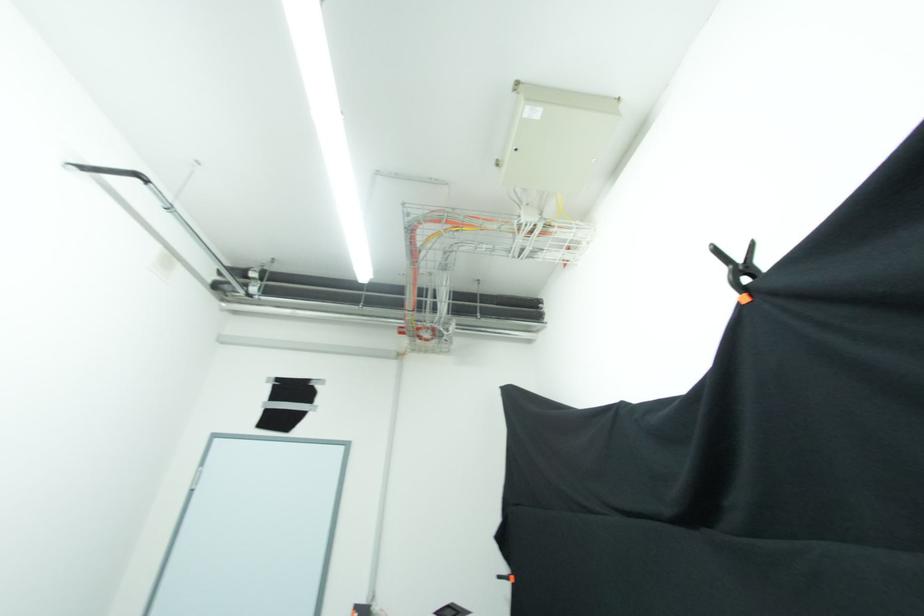
Find the location of `black clamp handle`. black clamp handle is located at coordinates (506, 578).